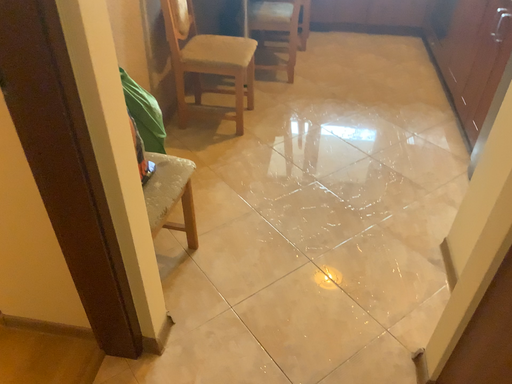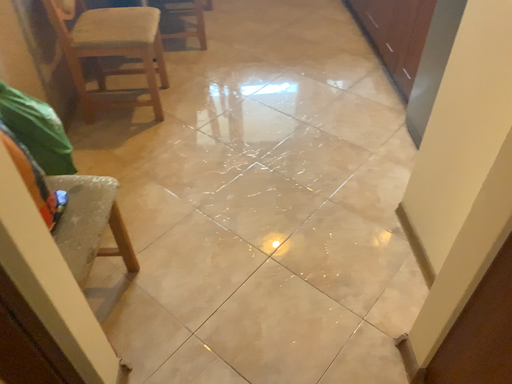
Question: How did the camera likely rotate when shooting the video?

Choices:
 (A) rotated left
 (B) rotated right

Answer: (B)